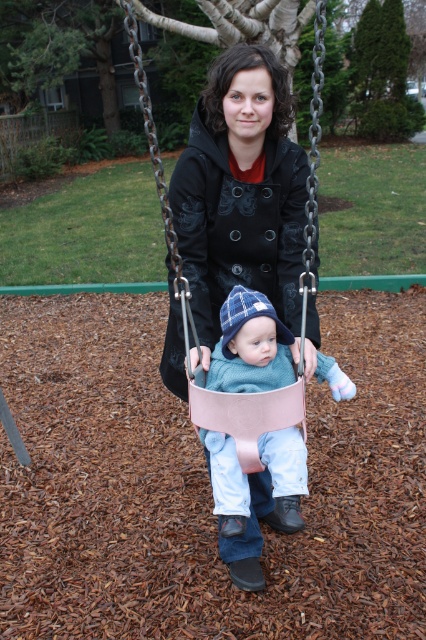
Question: Which point is farther to the camera?

Choices:
 (A) (299, 529)
 (B) (252, 429)

Answer: (A)

Question: In this image, where is pink leather swing at center located relative to light blue knit sweater at center?

Choices:
 (A) left
 (B) right

Answer: (B)

Question: Which of the following is the closest to the observer?

Choices:
 (A) (233, 442)
 (B) (308, 173)

Answer: (A)

Question: Among these points, which one is farthest from the camera?

Choices:
 (A) (236, 380)
 (B) (192, 122)

Answer: (B)

Question: Does pink leather swing at center have a lesser width compared to light blue knit sweater at center?

Choices:
 (A) no
 (B) yes

Answer: (A)

Question: Can you confirm if pink leather swing at center is thinner than light blue knit sweater at center?

Choices:
 (A) no
 (B) yes

Answer: (A)